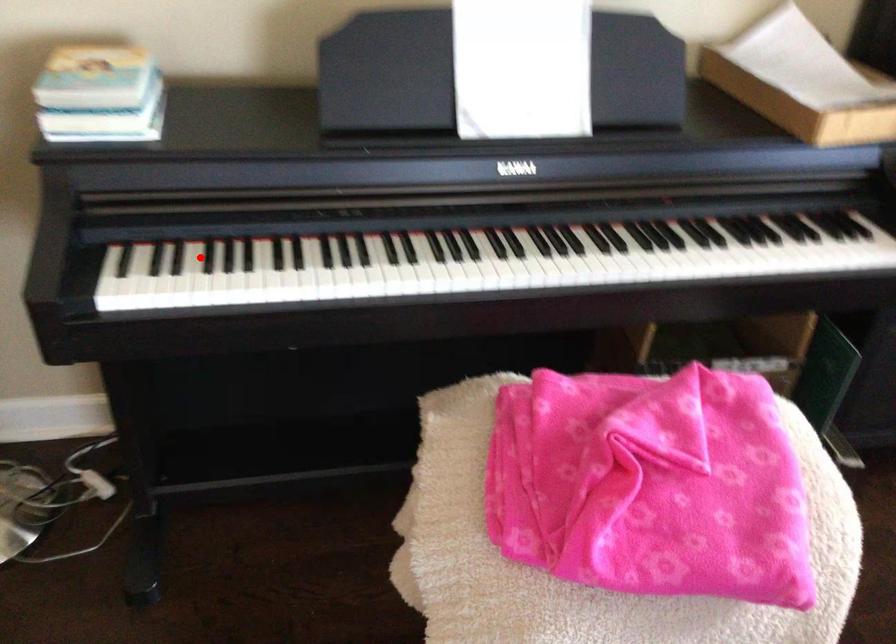
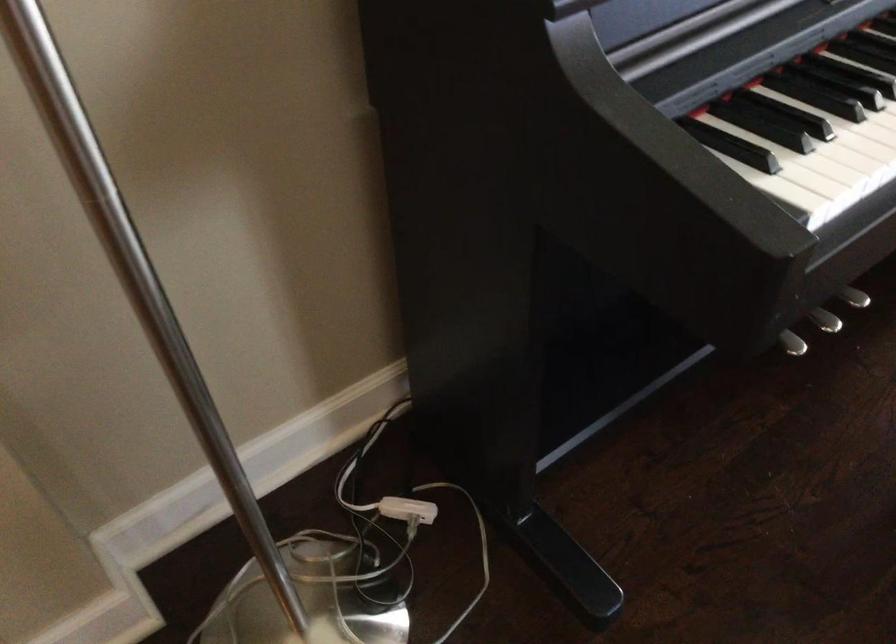
Question: A red point is marked in image1. In image2, is the corresponding 3D point closer to the camera or farther? Reply with the corresponding letter.

Choices:
 (A) The corresponding 3D point is closer.
 (B) The corresponding 3D point is farther.

Answer: (A)